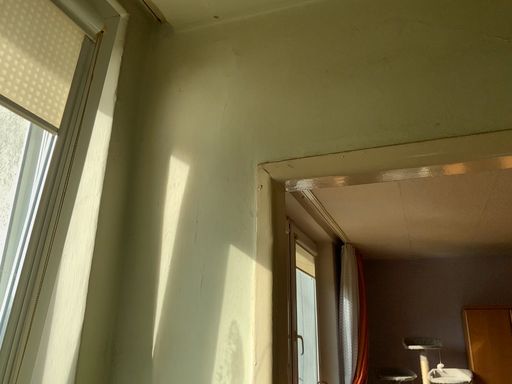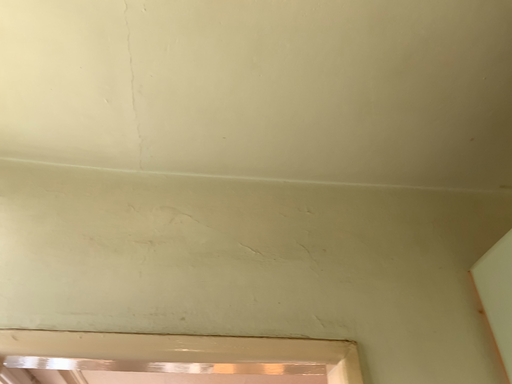
Question: How did the camera likely rotate when shooting the video?

Choices:
 (A) rotated upward
 (B) rotated downward

Answer: (A)